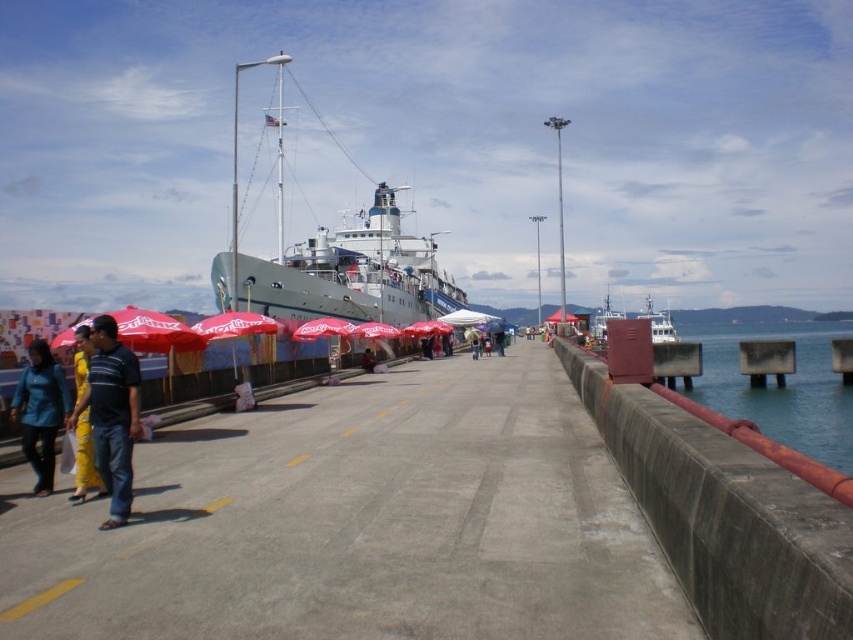
Question: Among these points, which one is nearest to the camera?

Choices:
 (A) (248, 65)
 (B) (56, 372)
 (C) (833, 448)
 (D) (368, 348)

Answer: (B)

Question: Considering the real-world distances, which object is farthest from the silver metallic ship at center?

Choices:
 (A) blue fabric jacket at lower left
 (B) metallic gray boat at right
 (C) red fabric umbrella at center

Answer: (C)

Question: Can you confirm if silver metallic ship at center is bigger than clear blue water at right?

Choices:
 (A) no
 (B) yes

Answer: (B)

Question: Where is clear blue water at right located in relation to matte black shirt at left in the image?

Choices:
 (A) left
 (B) right

Answer: (B)

Question: Does clear blue water at right appear on the right side of blue fabric jacket at lower left?

Choices:
 (A) yes
 (B) no

Answer: (A)

Question: Which point is closer to the camera taking this photo?

Choices:
 (A) (228, 305)
 (B) (648, 320)

Answer: (B)